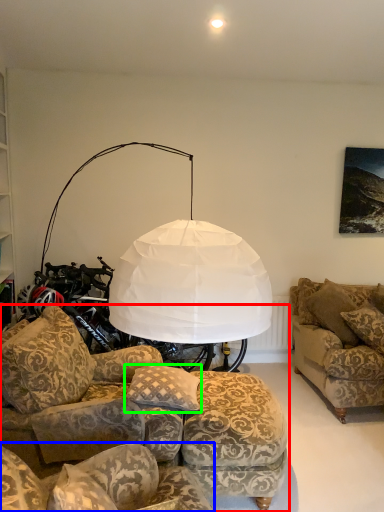
Question: Based on their relative distances, which object is farther from studio couch (highlighted by a red box)? Choose from studio couch (highlighted by a blue box) and pillow (highlighted by a green box).

Choices:
 (A) studio couch
 (B) pillow

Answer: (A)